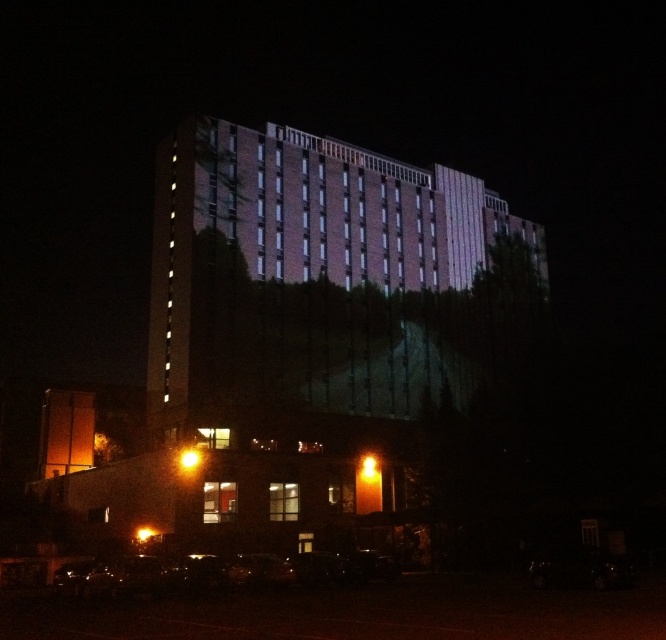
You are standing at the origin point in the image. Which direction should you move to reach the brick textured building at center?

The brick textured building at center is located at point [306,275], so you should move towards the center of the image to reach it.

You are standing in front of the building and want to reach the point marked at coordinates point (226,396). If your walking speed is 1.2 meters per second, how many seconds will it take you to reach that point?

The point (226,396) is 63.90 meters away from the viewer. At a walking speed of 1.2 meters per second, it would take 63.90 divided by 1.2, which equals approximately 53.25 seconds to reach the point.

You are standing in front of the brick textured building at center and want to walk to the shiny black car at lower center. Which direction should you move to reach it?

Since the brick textured building at center is further to the viewer than the shiny black car at lower center, you should move forward towards the shiny black car at lower center to reach it.